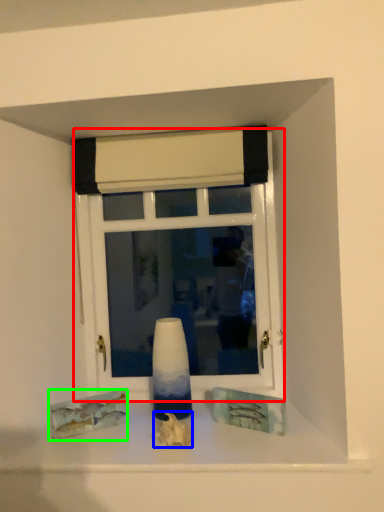
Question: Considering the real-world distances, which object is farthest from window (highlighted by a red box)? art (highlighted by a blue box) or art (highlighted by a green box)?

Choices:
 (A) art
 (B) art

Answer: (A)